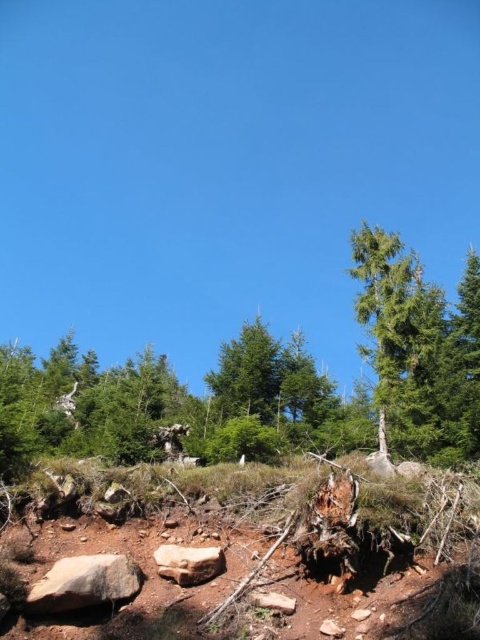
Who is shorter, brown dirt at center or green textured tree at center?

brown dirt at center is shorter.

This screenshot has width=480, height=640. In order to click on brown dirt at center in this screenshot , I will do point(267,556).

Where is `brown dirt at center`? This screenshot has width=480, height=640. brown dirt at center is located at coordinates (267, 556).

Does brown rough rock at lower left have a smaller size compared to smooth beige rock at center?

No, brown rough rock at lower left is not smaller than smooth beige rock at center.

Between brown rough rock at lower left and smooth beige rock at center, which one appears on the left side from the viewer's perspective?

brown rough rock at lower left

The width and height of the screenshot is (480, 640). What do you see at coordinates (84, 582) in the screenshot? I see `brown rough rock at lower left` at bounding box center [84, 582].

Locate an element on the screen. The image size is (480, 640). brown rough rock at lower left is located at coordinates (84, 582).

Is green textured tree at center closer to camera compared to brown rough rock at lower left?

No, green textured tree at center is further to the viewer.

Describe the element at coordinates (267, 385) in the screenshot. The image size is (480, 640). I see `green textured tree at center` at that location.

The width and height of the screenshot is (480, 640). I want to click on green textured tree at center, so click(x=267, y=385).